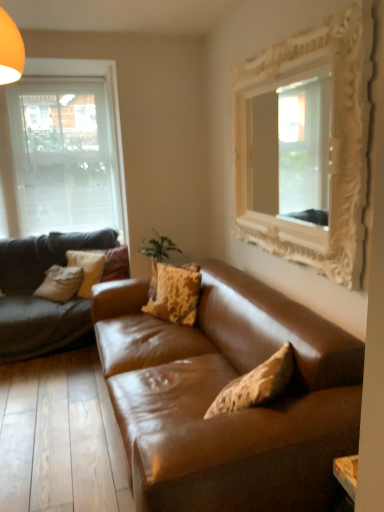
The width and height of the screenshot is (384, 512). What do you see at coordinates (87, 267) in the screenshot? I see `camouflage-patterned fabric pillow at center-left, the 3th pillow positioned from the right` at bounding box center [87, 267].

In order to face transparent glass window at left, should I rotate leftwards or rightwards?

You should look left and rotate roughly 18.442 degrees.

Where is `camouflage-patterned fabric pillow at center-left, the 3th pillow positioned from the right`? camouflage-patterned fabric pillow at center-left, the 3th pillow positioned from the right is located at coordinates (87, 267).

Considering the relative positions of transparent glass window at left and camouflage-patterned fabric pillow at center-left, the 3th pillow positioned from the right, in the image provided, is transparent glass window at left to the right of camouflage-patterned fabric pillow at center-left, the 3th pillow positioned from the right, from the viewer's perspective?

No.

Are transparent glass window at left and camouflage-patterned fabric pillow at center-left, which ranks as the second pillow in back-to-front order, making contact?

No, transparent glass window at left is not making contact with camouflage-patterned fabric pillow at center-left, which ranks as the second pillow in back-to-front order.

Is transparent glass window at left bigger or smaller than camouflage-patterned fabric pillow at center-left, the 3th pillow positioned from the right?

transparent glass window at left is bigger than camouflage-patterned fabric pillow at center-left, the 3th pillow positioned from the right.

Which is closer to the camera, (102, 265) or (120, 256)?

Point (102, 265)

Does camouflage-patterned fabric pillow at center-left, the second pillow from the front, appear on the left side of camouflage-patterned fabric pillow at center, marked as the third pillow in a front-to-back arrangement?

Correct, you'll find camouflage-patterned fabric pillow at center-left, the second pillow from the front, to the left of camouflage-patterned fabric pillow at center, marked as the third pillow in a front-to-back arrangement.

Can you confirm if camouflage-patterned fabric pillow at center-left, the 3th pillow positioned from the right, is thinner than camouflage-patterned fabric pillow at center, marked as the third pillow in a front-to-back arrangement?

Correct, the width of camouflage-patterned fabric pillow at center-left, the 3th pillow positioned from the right, is less than that of camouflage-patterned fabric pillow at center, marked as the third pillow in a front-to-back arrangement.

How much distance is there between camouflage-patterned fabric pillow at center-left, which ranks as the 1th pillow in left-to-right order, and camouflage-patterned fabric pillow at center, marked as the third pillow in a front-to-back arrangement?

They are 5.63 inches apart.

At what (x,y) coordinates should I click in order to perform the action: click on window lying behind the camouflage-patterned fabric pillow at center, the second pillow positioned from the left. Please return your answer as a coordinate pair (x, y). Looking at the image, I should click on (64, 149).

Is camouflage-patterned fabric pillow at center, marked as the third pillow in a front-to-back arrangement, at the left side of transparent glass window at left?

In fact, camouflage-patterned fabric pillow at center, marked as the third pillow in a front-to-back arrangement, is to the right of transparent glass window at left.

Which of these two, camouflage-patterned fabric pillow at center, which appears as the 2th pillow when viewed from the right, or transparent glass window at left, is thinner?

Thinner between the two is transparent glass window at left.

Is camouflage-patterned fabric pillow at center, the second pillow positioned from the left, positioned in front of transparent glass window at left?

Yes, it is.

From the image's perspective, which is above, camouflage-patterned fabric pillow at center, acting as the first pillow starting from the back, or camouflage-patterned fabric pillow at center, the third pillow in the left-to-right sequence?

camouflage-patterned fabric pillow at center, acting as the first pillow starting from the back, from the image's perspective.

Based on their positions, is camouflage-patterned fabric pillow at center, acting as the first pillow starting from the back, located to the left or right of camouflage-patterned fabric pillow at center, which is counted as the first pillow, starting from the front?

camouflage-patterned fabric pillow at center, acting as the first pillow starting from the back, is positioned on camouflage-patterned fabric pillow at center, which is counted as the first pillow, starting from the front,'s left side.

Which object is further away from the camera, camouflage-patterned fabric pillow at center, which appears as the 2th pillow when viewed from the right, or camouflage-patterned fabric pillow at center, which appears as the first pillow when viewed from the right?

camouflage-patterned fabric pillow at center, which appears as the 2th pillow when viewed from the right, is further away from the camera.

Between camouflage-patterned fabric pillow at center, which appears as the 2th pillow when viewed from the right, and camouflage-patterned fabric pillow at center, which is counted as the first pillow, starting from the front, which one has smaller width?

Thinner between the two is camouflage-patterned fabric pillow at center, which is counted as the first pillow, starting from the front.

Between brown leather couch at center and white ornate mirror at upper right, which one appears on the left side from the viewer's perspective?

brown leather couch at center.

From a real-world perspective, is brown leather couch at center on top of white ornate mirror at upper right?

No, from a real-world perspective, brown leather couch at center is not above white ornate mirror at upper right.

Is point (166, 453) behind point (331, 205)?

No, it is not.

From the image's perspective, does brown leather couch at center appear higher than white ornate mirror at upper right?

Incorrect, from the image's perspective, brown leather couch at center is lower than white ornate mirror at upper right.

Which is nearer, (88, 280) or (181, 307)?

Point (88, 280) appears to be farther away from the viewer than point (181, 307).

Could camouflage-patterned fabric pillow at center, acting as the third pillow starting from the back, be considered to be inside camouflage-patterned fabric pillow at center-left, which ranks as the second pillow in back-to-front order?

No, camouflage-patterned fabric pillow at center, acting as the third pillow starting from the back, is not inside camouflage-patterned fabric pillow at center-left, which ranks as the second pillow in back-to-front order.

Is camouflage-patterned fabric pillow at center-left, the second pillow from the front, at the left side of camouflage-patterned fabric pillow at center, the third pillow in the left-to-right sequence?

Correct, you'll find camouflage-patterned fabric pillow at center-left, the second pillow from the front, to the left of camouflage-patterned fabric pillow at center, the third pillow in the left-to-right sequence.

From a real-world perspective, is camouflage-patterned fabric pillow at center-left, the second pillow from the front, beneath camouflage-patterned fabric pillow at center, which is counted as the first pillow, starting from the front?

Yes.

Is white ornate mirror at upper right in front of or behind brown leather couch at center in the image?

Clearly, white ornate mirror at upper right is behind brown leather couch at center.

Which of these two, white ornate mirror at upper right or brown leather couch at center, is bigger?

Bigger between the two is brown leather couch at center.

From the image's perspective, which one is positioned higher, white ornate mirror at upper right or brown leather couch at center?

white ornate mirror at upper right appears higher in the image.

Identify the location of window located behind the camouflage-patterned fabric pillow at center-left, the second pillow from the front. This screenshot has width=384, height=512. (64, 149).

The image size is (384, 512). I want to click on pillow above the camouflage-patterned fabric pillow at center-left, the second pillow from the front (from the image's perspective), so click(x=116, y=264).

Estimate the real-world distances between objects in this image. Which object is closer to white ornate mirror at upper right, camouflage-patterned fabric pillow at center, which is counted as the first pillow, starting from the front, or camouflage-patterned fabric pillow at center, the second pillow positioned from the left?

camouflage-patterned fabric pillow at center, which is counted as the first pillow, starting from the front, is closer to white ornate mirror at upper right.

Looking at the image, which one is located further to brown leather couch at center, transparent glass window at left or camouflage-patterned fabric pillow at center-left, the 3th pillow positioned from the right?

transparent glass window at left is further to brown leather couch at center.

From the image, which object appears to be nearer to brown leather couch at center, camouflage-patterned fabric pillow at center-left, the 3th pillow positioned from the right, or camouflage-patterned fabric pillow at center, marked as the third pillow in a front-to-back arrangement?

Among the two, camouflage-patterned fabric pillow at center-left, the 3th pillow positioned from the right, is located nearer to brown leather couch at center.

Looking at the image, which one is located closer to camouflage-patterned fabric pillow at center, the third pillow in the left-to-right sequence, camouflage-patterned fabric pillow at center-left, which ranks as the second pillow in back-to-front order, or camouflage-patterned fabric pillow at center, which appears as the 2th pillow when viewed from the right?

camouflage-patterned fabric pillow at center-left, which ranks as the second pillow in back-to-front order, is closer to camouflage-patterned fabric pillow at center, the third pillow in the left-to-right sequence.

From the image, which object appears to be farther from camouflage-patterned fabric pillow at center, which appears as the 2th pillow when viewed from the right, brown leather couch at center or camouflage-patterned fabric pillow at center-left, which ranks as the second pillow in back-to-front order?

brown leather couch at center lies further to camouflage-patterned fabric pillow at center, which appears as the 2th pillow when viewed from the right, than the other object.

Based on their spatial positions, is white ornate mirror at upper right or camouflage-patterned fabric pillow at center, which appears as the first pillow when viewed from the right, further from brown leather couch at center?

white ornate mirror at upper right lies further to brown leather couch at center than the other object.

Considering their positions, is white ornate mirror at upper right positioned closer to transparent glass window at left than brown leather couch at center?

white ornate mirror at upper right is closer to transparent glass window at left.

Considering their positions, is transparent glass window at left positioned closer to white ornate mirror at upper right than camouflage-patterned fabric pillow at center-left, the 3th pillow positioned from the right?

camouflage-patterned fabric pillow at center-left, the 3th pillow positioned from the right.

This screenshot has height=512, width=384. What are the coordinates of `pillow between transparent glass window at left and camouflage-patterned fabric pillow at center-left, which ranks as the second pillow in back-to-front order, vertically` in the screenshot? It's located at (116, 264).

This screenshot has height=512, width=384. What are the coordinates of `picture frame between brown leather couch at center and camouflage-patterned fabric pillow at center, which appears as the 2th pillow when viewed from the right, from front to back` in the screenshot? It's located at (330, 143).

Where is `pillow located between camouflage-patterned fabric pillow at center, the third pillow in the left-to-right sequence, and camouflage-patterned fabric pillow at center, the second pillow positioned from the left, in the depth direction`? The width and height of the screenshot is (384, 512). pillow located between camouflage-patterned fabric pillow at center, the third pillow in the left-to-right sequence, and camouflage-patterned fabric pillow at center, the second pillow positioned from the left, in the depth direction is located at coordinates (87, 267).

At what (x,y) coordinates should I click in order to perform the action: click on picture frame located between brown leather couch at center and transparent glass window at left in the depth direction. Please return your answer as a coordinate pair (x, y). Image resolution: width=384 pixels, height=512 pixels. Looking at the image, I should click on (330, 143).